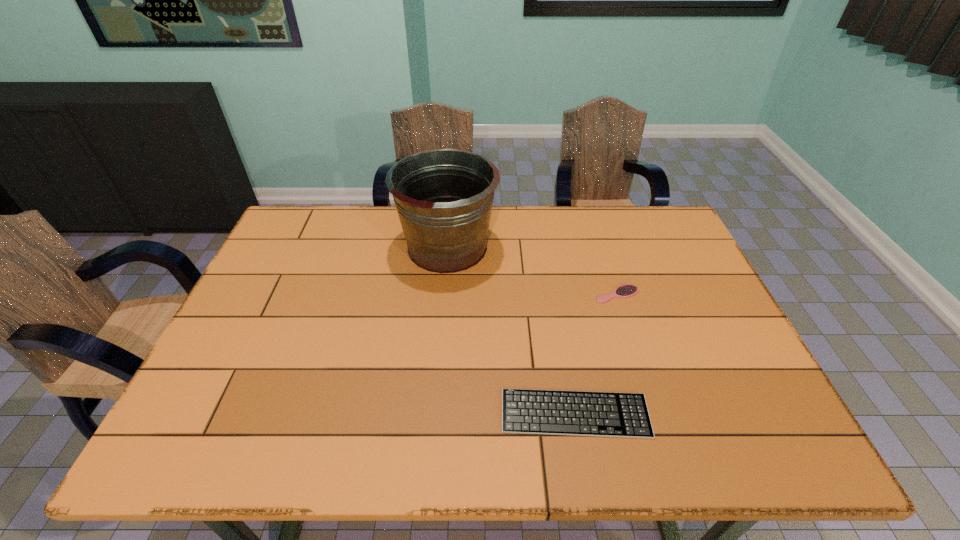
Identify the location of free space that satisfies the following two spatial constraints: 1. on the front side of the computer keyboard; 2. on the left side of the farthest object. (433, 414).

The height and width of the screenshot is (540, 960). Find the location of `free space that satisfies the following two spatial constraints: 1. on the back side of the computer keyboard; 2. on the right side of the hairbrush`. free space that satisfies the following two spatial constraints: 1. on the back side of the computer keyboard; 2. on the right side of the hairbrush is located at coordinates (554, 294).

This screenshot has height=540, width=960. Find the location of `vacant space that satisfies the following two spatial constraints: 1. on the front side of the second shortest object; 2. on the right side of the farthest object`. vacant space that satisfies the following two spatial constraints: 1. on the front side of the second shortest object; 2. on the right side of the farthest object is located at coordinates (444, 294).